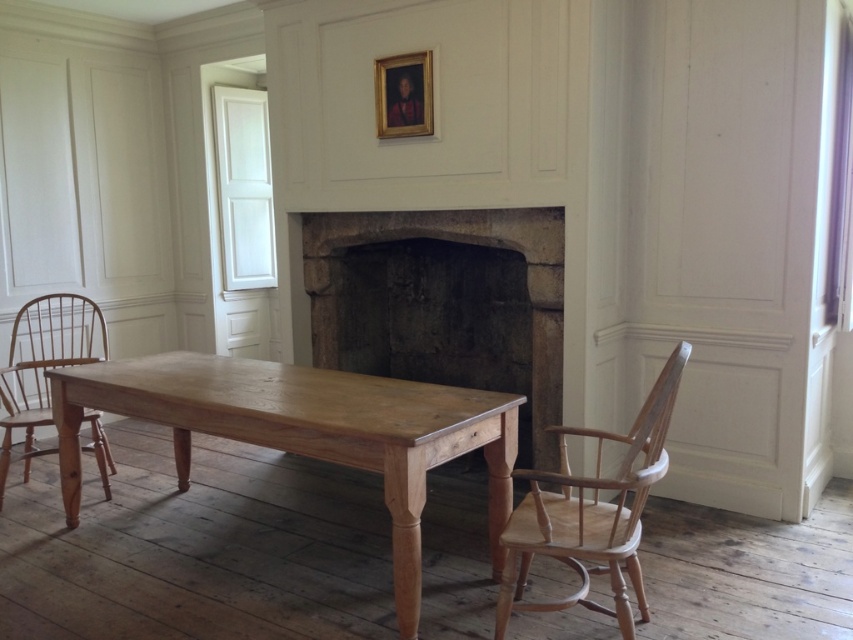
Question: Among these points, which one is nearest to the camera?

Choices:
 (A) (416, 621)
 (B) (544, 212)
 (C) (62, 356)
 (D) (643, 493)

Answer: (D)

Question: From the image, what is the correct spatial relationship of light brown wood table at center in relation to gold-framed portrait at upper center?

Choices:
 (A) right
 (B) left

Answer: (B)

Question: Which of these objects is positioned farthest from the gold-framed portrait at upper center?

Choices:
 (A) light brown wood chair at left
 (B) light brown wood table at center
 (C) stone fireplace at center

Answer: (A)

Question: Which is farther from the light brown wood chair at left?

Choices:
 (A) stone fireplace at center
 (B) light brown wood table at center
 (C) gold-framed portrait at upper center

Answer: (C)

Question: From the image, what is the correct spatial relationship of light brown wood table at center in relation to gold-framed portrait at upper center?

Choices:
 (A) left
 (B) right

Answer: (A)

Question: Is light brown wood table at center smaller than natural wood chair at right?

Choices:
 (A) yes
 (B) no

Answer: (B)